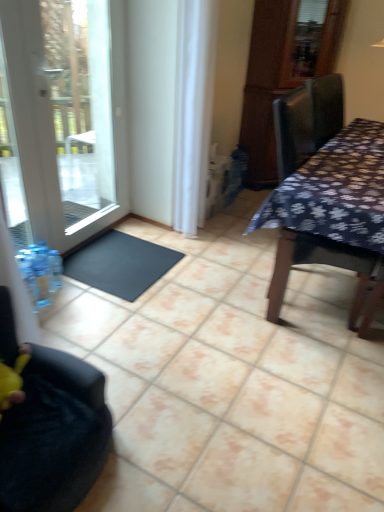
Question: Is white glass door at left taller than dark floral fabric table at right?

Choices:
 (A) yes
 (B) no

Answer: (A)

Question: Would you consider white glass door at left to be distant from dark floral fabric table at right?

Choices:
 (A) yes
 (B) no

Answer: (A)

Question: Is dark floral fabric table at right surrounded by white glass door at left?

Choices:
 (A) no
 (B) yes

Answer: (A)

Question: Are white glass door at left and dark floral fabric table at right beside each other?

Choices:
 (A) no
 (B) yes

Answer: (A)

Question: Does white glass door at left appear on the right side of dark floral fabric table at right?

Choices:
 (A) yes
 (B) no

Answer: (B)

Question: Is white glass door at left turned away from dark floral fabric table at right?

Choices:
 (A) yes
 (B) no

Answer: (B)

Question: Is black fabric chair at lower left turned away from black rubber doormat at lower left?

Choices:
 (A) yes
 (B) no

Answer: (B)

Question: Does black fabric chair at lower left have a lesser width compared to black rubber doormat at lower left?

Choices:
 (A) no
 (B) yes

Answer: (A)

Question: Is there a large distance between black fabric chair at lower left and black rubber doormat at lower left?

Choices:
 (A) yes
 (B) no

Answer: (B)

Question: Does black fabric chair at lower left have a greater width compared to black rubber doormat at lower left?

Choices:
 (A) yes
 (B) no

Answer: (A)

Question: From a real-world perspective, does black fabric chair at lower left stand above black rubber doormat at lower left?

Choices:
 (A) no
 (B) yes

Answer: (B)

Question: Is black fabric chair at lower left at the left side of black rubber doormat at lower left?

Choices:
 (A) no
 (B) yes

Answer: (B)

Question: Is black rubber doormat at lower left inside dark floral fabric table at right?

Choices:
 (A) no
 (B) yes

Answer: (A)